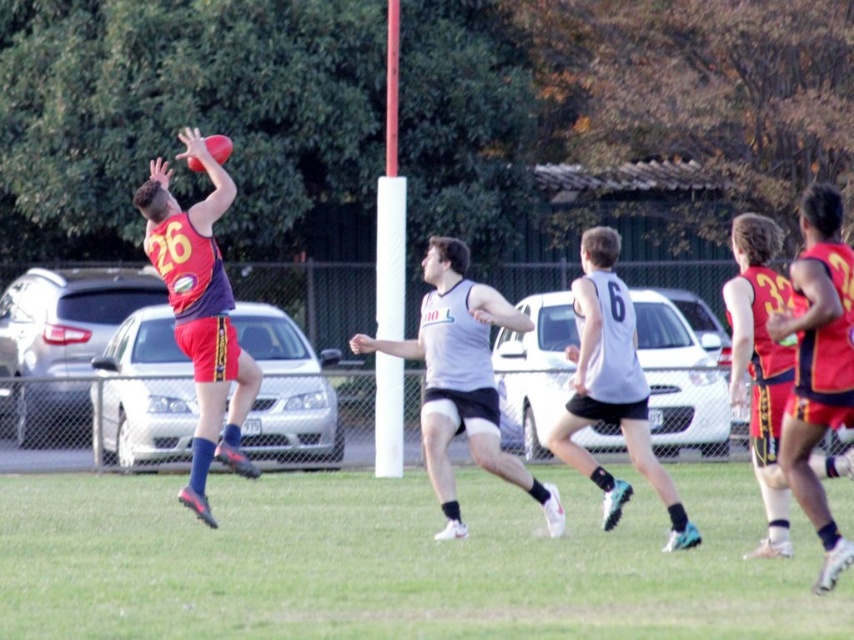
Question: Among these points, which one is nearest to the camera?

Choices:
 (A) (192, 307)
 (B) (791, 561)

Answer: (B)

Question: Can you confirm if green grass at center is thinner than gray matte jersey at center?

Choices:
 (A) no
 (B) yes

Answer: (A)

Question: Which object is closer to the camera taking this photo?

Choices:
 (A) white matte jersey at center
 (B) matte red jersey at left
 (C) gray matte jersey at center

Answer: (A)

Question: Which object is farther from the camera taking this photo?

Choices:
 (A) green grass at center
 (B) gray matte jersey at center
 (C) white matte jersey at center

Answer: (B)

Question: Does green grass at center appear on the left side of gray matte jersey at center?

Choices:
 (A) yes
 (B) no

Answer: (B)

Question: Does green grass at center appear under gray matte jersey at center?

Choices:
 (A) no
 (B) yes

Answer: (B)